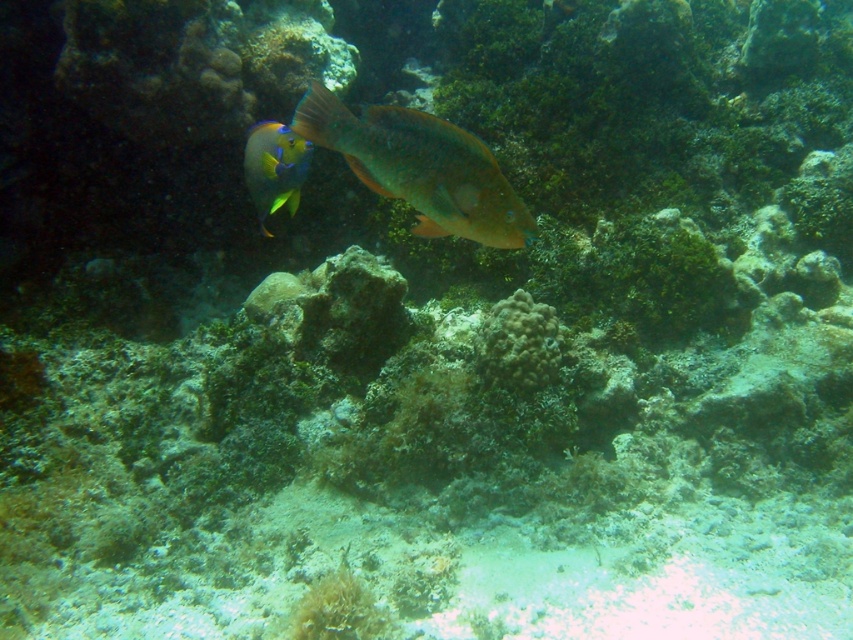
Question: Where is shiny orange fish at center located in relation to rough textured coral at center in the image?

Choices:
 (A) above
 (B) below

Answer: (A)

Question: Estimate the real-world distances between objects in this image. Which object is farther from the rough textured coral at center?

Choices:
 (A) shiny blue fish at center
 (B) shiny orange fish at center

Answer: (A)

Question: Is shiny orange fish at center below rough textured coral at center?

Choices:
 (A) yes
 (B) no

Answer: (B)

Question: Which point is farther from the camera taking this photo?

Choices:
 (A) (515, 384)
 (B) (486, 216)
 (C) (265, 124)

Answer: (C)

Question: Which point is farther to the camera?

Choices:
 (A) shiny orange fish at center
 (B) rough textured coral at center

Answer: (B)

Question: Is shiny orange fish at center wider than shiny blue fish at center?

Choices:
 (A) no
 (B) yes

Answer: (B)